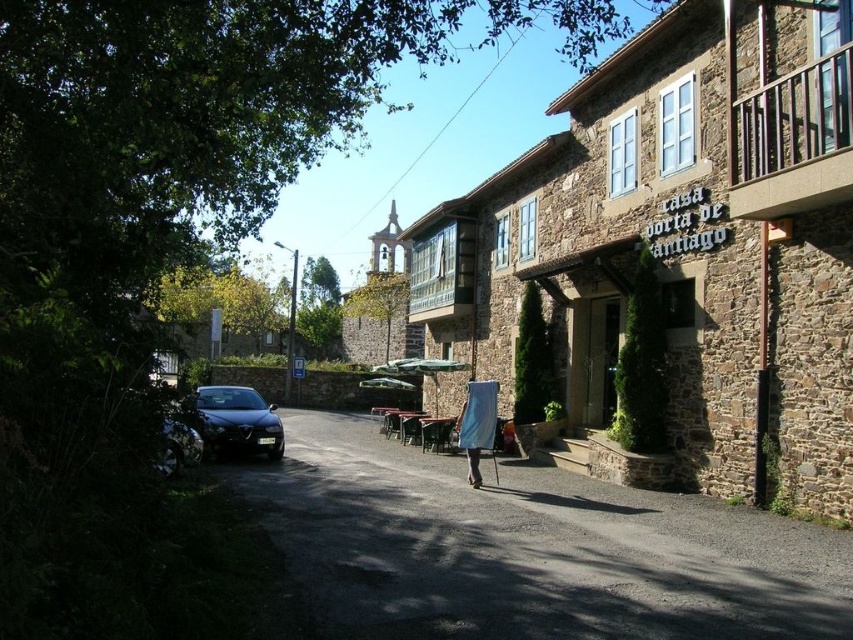
You are standing on the street and want to cross to the other side. There is a dark asphalt road at center and a blue fabric at center. Which one is higher from the ground?

The dark asphalt road at center is much taller than the blue fabric at center, so the dark asphalt road at center is higher from the ground.

You are standing on the quaint street scene and want to walk towards the two points marked in the image. Which point, point (677, 605) or point (271, 456), will you reach first?

Point (677, 605) is closer to the viewer than point (271, 456), so you will reach point (677, 605) first.

You are a delivery person trying to park your van on the dark asphalt road at center. The van is the same size as the shiny black car at center. Can you park your van there without overlapping other vehicles?

The dark asphalt road at center is smaller than the shiny black car at center. Since your van is the same size as the shiny black car at center, there isn not enough space to park your van there without overlapping other vehicles.